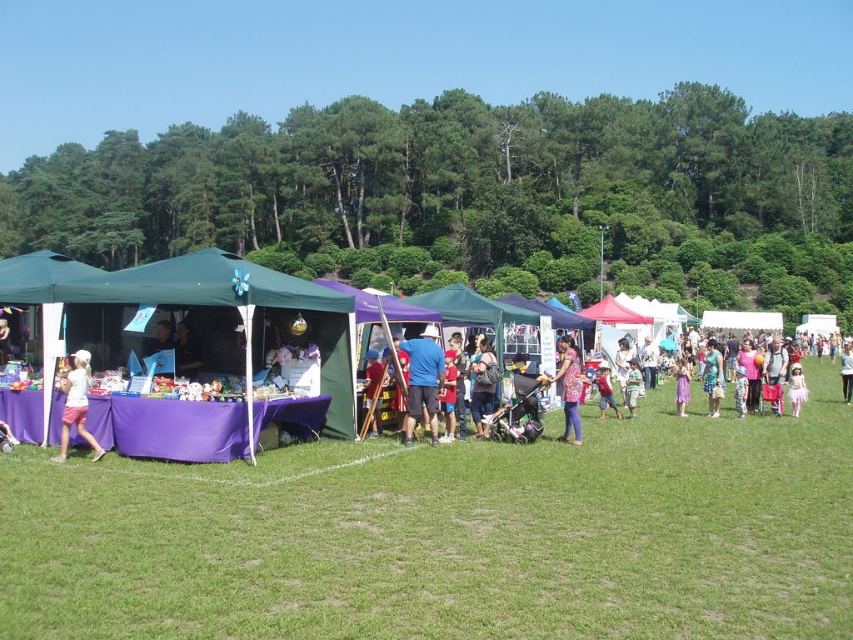
Who is more distant from viewer, (76,378) or (471,412)?

Positioned behind is point (471,412).

Is white matte dress at lower left to the right of matte blue jeans at center from the viewer's perspective?

In fact, white matte dress at lower left is to the left of matte blue jeans at center.

This screenshot has height=640, width=853. I want to click on white matte dress at lower left, so click(x=76, y=404).

Can you confirm if white matte dress at lower left is positioned to the right of purple cotton dress at center?

In fact, white matte dress at lower left is to the left of purple cotton dress at center.

Does white matte dress at lower left have a lesser width compared to purple cotton dress at center?

Indeed, white matte dress at lower left has a lesser width compared to purple cotton dress at center.

Who is more forward, [73,371] or [682,410]?

Point [73,371]

Find the location of a particular element. white matte dress at lower left is located at coordinates (76, 404).

Who is lower down, matte blue jeans at center or purple cotton dress at center?

purple cotton dress at center is below.

Is point (486, 353) positioned before point (683, 392)?

That is True.

Which is behind, point (490, 387) or point (677, 396)?

The point (677, 396) is more distant.

The height and width of the screenshot is (640, 853). What are the coordinates of `matte blue jeans at center` in the screenshot? It's located at (483, 385).